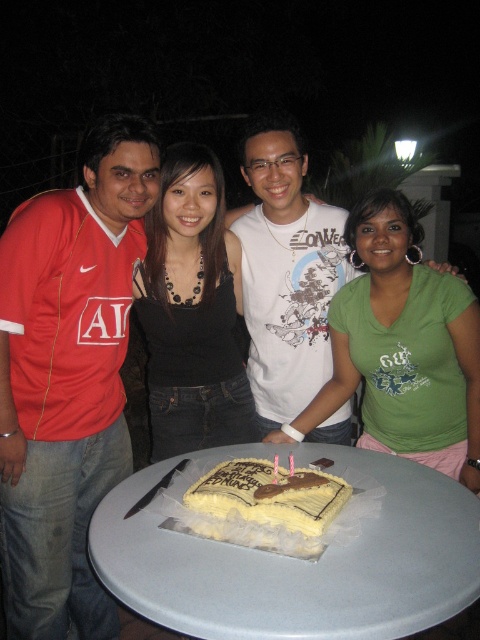
What do you see at coordinates (68, 376) in the screenshot?
I see `matte red jersey at left` at bounding box center [68, 376].

What are the coordinates of `matte red jersey at left` in the screenshot? It's located at (68, 376).

Between matte red jersey at left and white cotton tank top at center, which one has less height?

white cotton tank top at center

Which is more to the right, matte red jersey at left or white cotton tank top at center?

From the viewer's perspective, white cotton tank top at center appears more on the right side.

Is point (116, 224) positioned before point (304, 369)?

That is True.

This screenshot has width=480, height=640. I want to click on matte red jersey at left, so click(x=68, y=376).

Who is lower down, black fabric top at center or yellow frosted rectangular cake at center?

Positioned lower is yellow frosted rectangular cake at center.

Is black fabric top at center wider than yellow frosted rectangular cake at center?

Yes.

Identify the location of black fabric top at center. The width and height of the screenshot is (480, 640). click(x=192, y=310).

Identify the location of black fabric top at center. (192, 310).